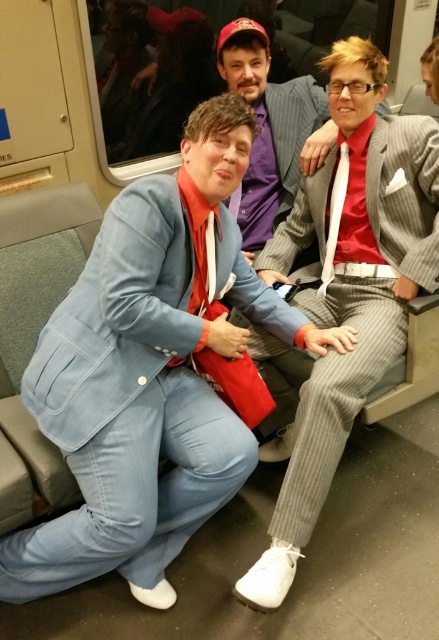
Question: Estimate the real-world distances between objects in this image. Which object is farther from the light blue denim suit at center?

Choices:
 (A) striped suit at center
 (B) gray pinstripe suit at right

Answer: (A)

Question: Among these points, which one is farthest from the camera?

Choices:
 (A) (107, 228)
 (B) (256, 598)

Answer: (A)

Question: Which object is the closest to the striped suit at center?

Choices:
 (A) light blue denim suit at center
 (B) gray pinstripe suit at right

Answer: (B)

Question: Does gray pinstripe suit at right lie behind striped suit at center?

Choices:
 (A) yes
 (B) no

Answer: (B)

Question: Is gray pinstripe suit at right positioned in front of striped suit at center?

Choices:
 (A) no
 (B) yes

Answer: (B)

Question: From the image, what is the correct spatial relationship of light blue denim suit at center in relation to gray pinstripe suit at right?

Choices:
 (A) below
 (B) above

Answer: (A)